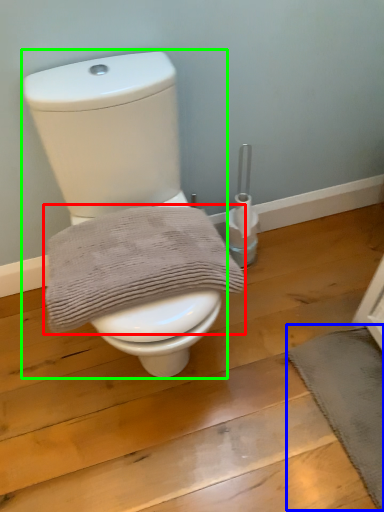
Question: Which object is the closest to the bath towel (highlighted by a red box)? Choose among these: bath mat (highlighted by a blue box) or toilet (highlighted by a green box).

Choices:
 (A) bath mat
 (B) toilet

Answer: (B)